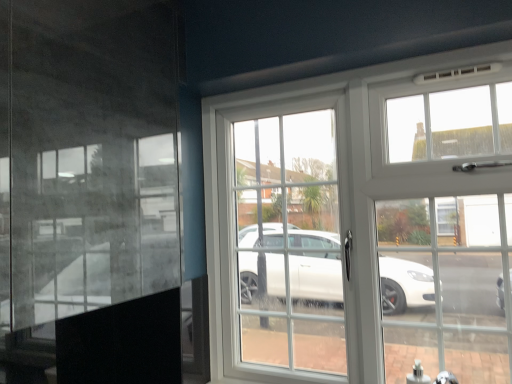
Identify the location of white plastic window at center. (366, 223).

What do you see at coordinates (366, 223) in the screenshot?
I see `white plastic window at center` at bounding box center [366, 223].

Image resolution: width=512 pixels, height=384 pixels. Find the location of `white plastic window at center`. white plastic window at center is located at coordinates (366, 223).